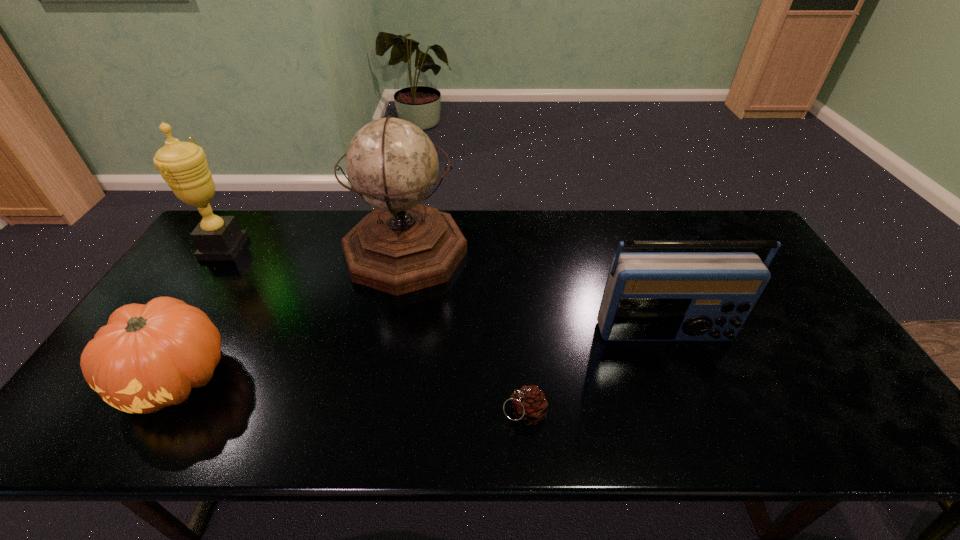
Locate an element on the screen. The width and height of the screenshot is (960, 540). empty space that is in between the second object from right to left and the rightmost object is located at coordinates (594, 373).

Find the location of a particular element. This screenshot has height=540, width=960. free space between the second shortest object and the fourth object from left to right is located at coordinates (350, 395).

The width and height of the screenshot is (960, 540). I want to click on free space between the trophy cup and the globe, so click(315, 250).

The width and height of the screenshot is (960, 540). Find the location of `vacant space that's between the trophy cup and the third object from right to left`. vacant space that's between the trophy cup and the third object from right to left is located at coordinates (315, 250).

The width and height of the screenshot is (960, 540). Find the location of `blank region between the trophy cup and the third shortest object`. blank region between the trophy cup and the third shortest object is located at coordinates (444, 291).

At what (x,y) coordinates should I click in order to perform the action: click on free space that is in between the third tallest object and the shortest object. Please return your answer as a coordinate pair (x, y). The image size is (960, 540). Looking at the image, I should click on (594, 373).

Where is `free space between the trophy cup and the third shortest object`? This screenshot has height=540, width=960. free space between the trophy cup and the third shortest object is located at coordinates (444, 291).

Locate which object ranks in proximity to the trophy cup. Please provide its 2D coordinates. Your answer should be formatted as a tuple, i.e. [(x, y)], where the tuple contains the x and y coordinates of a point satisfying the conditions above.

[(147, 357)]

Choose which object is the nearest neighbor to the radio receiver. Please provide its 2D coordinates. Your answer should be formatted as a tuple, i.e. [(x, y)], where the tuple contains the x and y coordinates of a point satisfying the conditions above.

[(529, 405)]